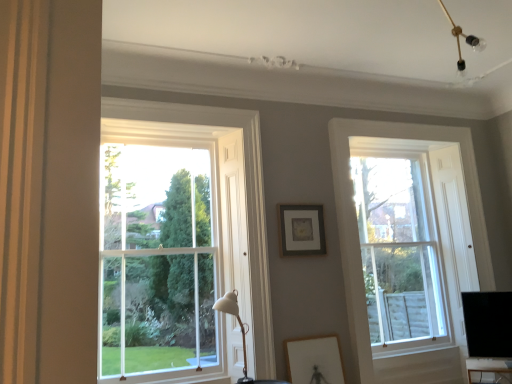
Question: Is black glossy monitor at lower right next to wooden framed picture at lower center, arranged as the 1th picture frame when ordered from the bottom, and touching it?

Choices:
 (A) no
 (B) yes

Answer: (A)

Question: Is there a large distance between black glossy monitor at lower right and wooden framed picture at lower center, arranged as the 1th picture frame when ordered from the bottom?

Choices:
 (A) yes
 (B) no

Answer: (A)

Question: Can you confirm if black glossy monitor at lower right is thinner than wooden framed picture at lower center, the 2th picture frame when ordered from back to front?

Choices:
 (A) no
 (B) yes

Answer: (A)

Question: From the image's perspective, is black glossy monitor at lower right beneath wooden framed picture at lower center, arranged as the 1th picture frame when ordered from the bottom?

Choices:
 (A) yes
 (B) no

Answer: (B)

Question: Is wooden framed picture at lower center, arranged as the 1th picture frame when ordered from the bottom, surrounded by black glossy monitor at lower right?

Choices:
 (A) yes
 (B) no

Answer: (B)

Question: Based on their sizes in the image, would you say clear glass window at left, which is the first window in front-to-back order, is bigger or smaller than wooden framed picture at lower center, arranged as the 1th picture frame when ordered from the bottom?

Choices:
 (A) big
 (B) small

Answer: (A)

Question: Is clear glass window at left, which is the first window in front-to-back order, in front of or behind wooden framed picture at lower center, which is the 2th picture frame from top to bottom, in the image?

Choices:
 (A) behind
 (B) front

Answer: (B)

Question: Is point (252, 114) positioned closer to the camera than point (309, 342)?

Choices:
 (A) closer
 (B) farther

Answer: (B)

Question: In terms of height, does clear glass window at left, which is the first window in front-to-back order, look taller or shorter compared to wooden framed picture at lower center, the 2th picture frame when ordered from back to front?

Choices:
 (A) short
 (B) tall

Answer: (B)

Question: Considering the positions of clear glass window at right, the first window positioned from the back, and clear glass window at left, which appears as the first window when viewed from the left, in the image, is clear glass window at right, the first window positioned from the back, bigger or smaller than clear glass window at left, which appears as the first window when viewed from the left,?

Choices:
 (A) small
 (B) big

Answer: (A)

Question: Is clear glass window at right, the first window positioned from the back, wider or thinner than clear glass window at left, which appears as the 2th window when viewed from the right?

Choices:
 (A) wide
 (B) thin

Answer: (B)

Question: Would you say clear glass window at right, which is counted as the 2th window, starting from the left, is inside or outside clear glass window at left, which appears as the 2th window when viewed from the right?

Choices:
 (A) inside
 (B) outside

Answer: (B)

Question: From a real-world perspective, is clear glass window at right, the first window positioned from the back, positioned above or below clear glass window at left, which appears as the 2th window when viewed from the right?

Choices:
 (A) above
 (B) below

Answer: (B)

Question: Relative to white matte table lamp at center, is clear glass window at left, which appears as the first window when viewed from the left, in front or behind?

Choices:
 (A) front
 (B) behind

Answer: (B)

Question: Considering the positions of point (216, 254) and point (228, 294), is point (216, 254) closer or farther from the camera than point (228, 294)?

Choices:
 (A) closer
 (B) farther

Answer: (B)